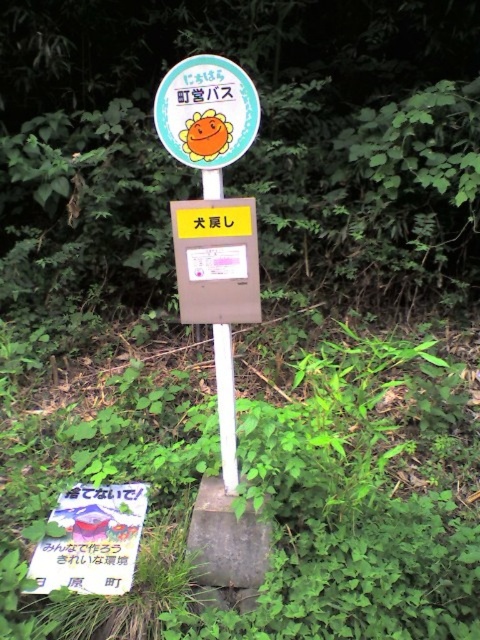
Question: Among these points, which one is farthest from the camera?

Choices:
 (A) (223, 392)
 (B) (255, 241)
 (C) (204, 52)

Answer: (C)

Question: Is matte brown box at center wider than brown wood pole at center?

Choices:
 (A) no
 (B) yes

Answer: (B)

Question: Does matte brown box at center have a lesser width compared to white plastic sign at center?

Choices:
 (A) yes
 (B) no

Answer: (A)

Question: Which is farther from the white plastic sign at center?

Choices:
 (A) brown wood pole at center
 (B) matte plastic sign at center
 (C) matte brown box at center

Answer: (A)

Question: Which of the following is the closest to the observer?

Choices:
 (A) (228, 486)
 (B) (196, 61)

Answer: (B)

Question: Is matte plastic sign at center wider than matte brown box at center?

Choices:
 (A) yes
 (B) no

Answer: (A)